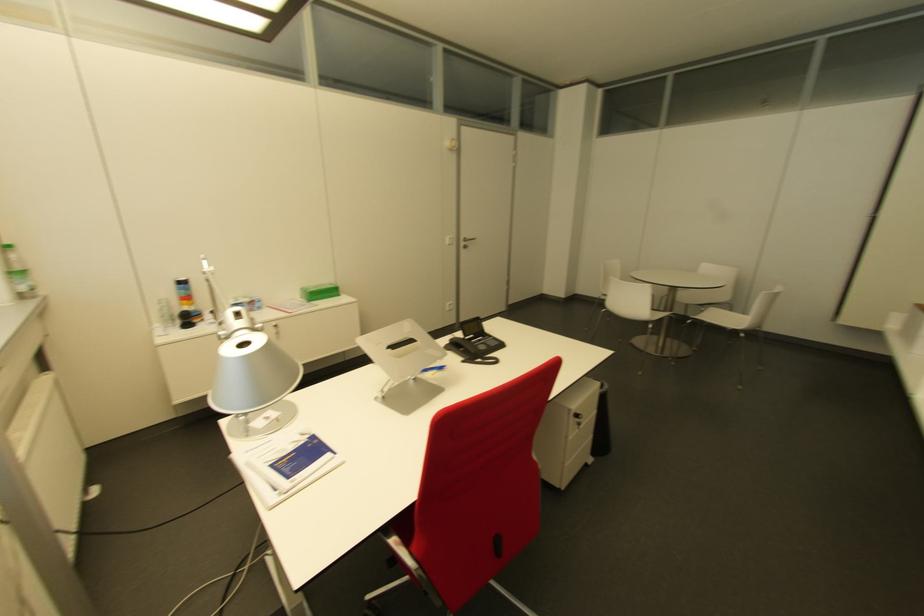
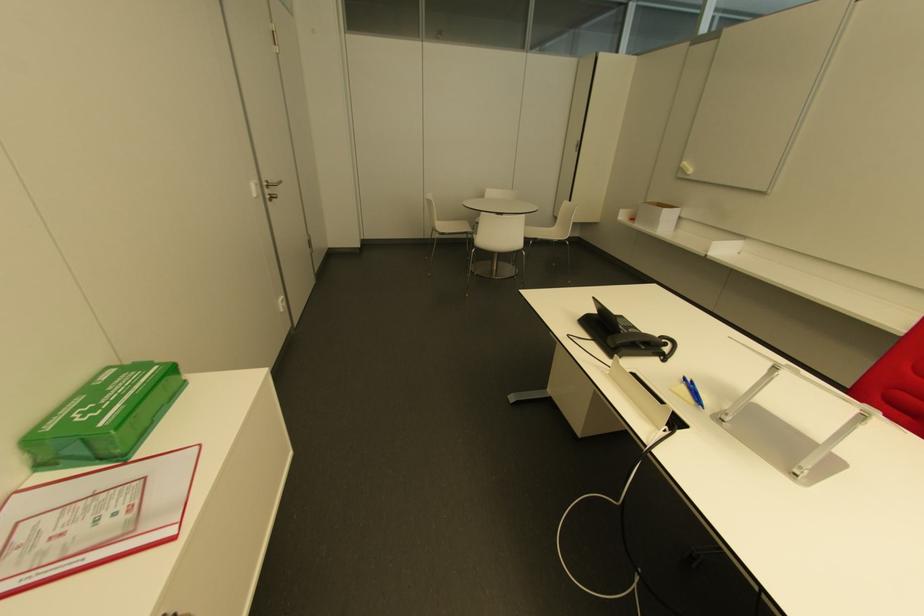
Find the pixel in the second image that matches point (743, 331) in the first image.

(565, 240)